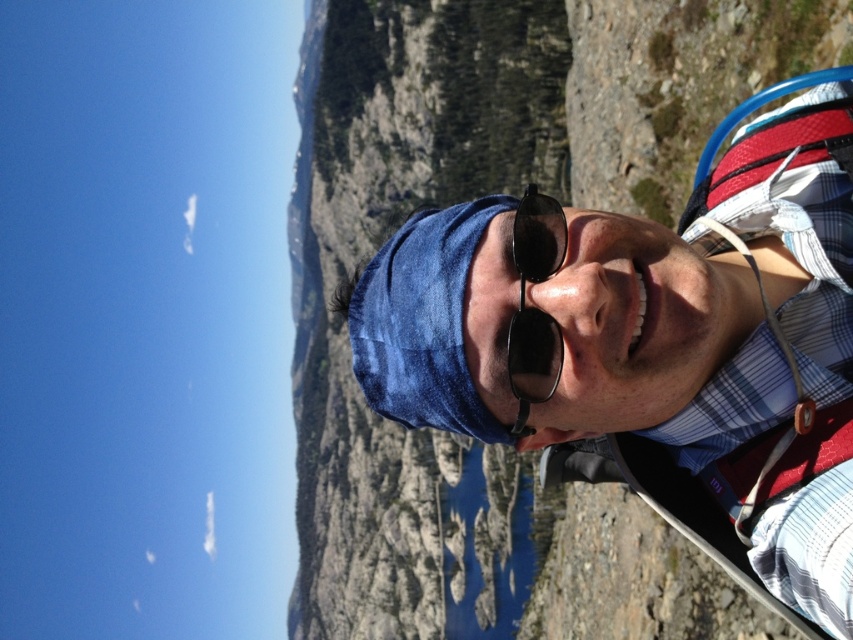
You are a hiker who wants to use the blue denim bandana at center and the white fabric strap at right to secure your gear. Which item should you choose if you need a larger size for better coverage?

The blue denim bandana at center has a larger size compared to the white fabric strap at right, so you should choose the blue denim bandana at center for better coverage.

You are a photographer trying to capture the perfect shot of the blue denim bandana at center. The bandana is located at point (471, 196) in the image coordinates. If your camera has a fixed focal length and you want to frame the bandana precisely at the center of your shot, which part of the scene should you focus on?

The blue denim bandana at center is located at point (471, 196), so you should focus on the blue denim bandana at center to center your shot.

You are a photographer trying to capture the adventurer in the scene. You need to ensure that both the black reflective sunglasses at center and the white fabric strap at right are clearly visible in your photo. Given their sizes, which object might require you to adjust your camera focus more carefully to avoid blurriness?

The black reflective sunglasses at center are wider than the white fabric strap at right, so you may need to adjust the camera focus more carefully on the black reflective sunglasses at center to ensure clarity.